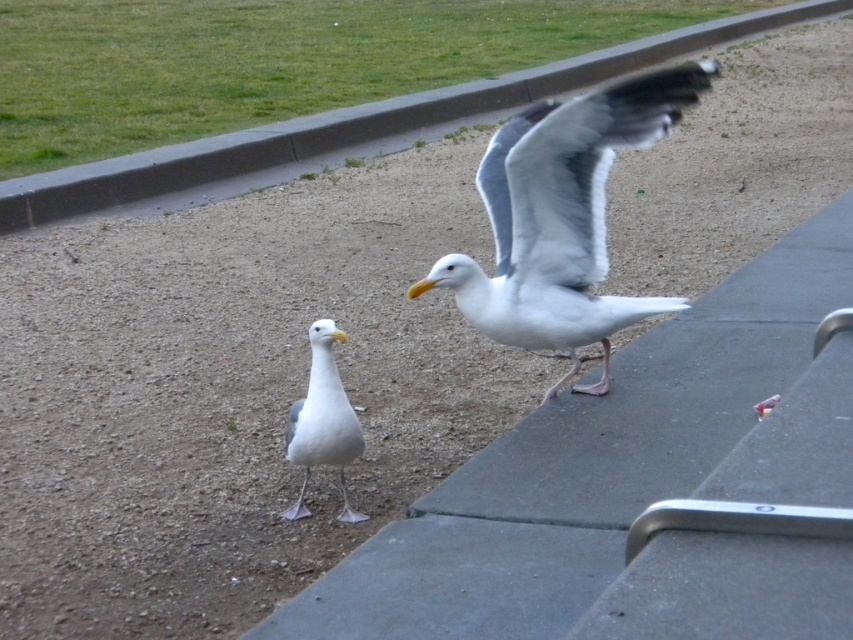
Does gray concrete curb at upper center have a larger size compared to white matte seagull at center?

Yes, gray concrete curb at upper center is bigger than white matte seagull at center.

What do you see at coordinates (347, 129) in the screenshot? I see `gray concrete curb at upper center` at bounding box center [347, 129].

Is point (764, 22) closer to camera compared to point (293, 435)?

No, it is behind (293, 435).

Where is `gray concrete curb at upper center`? This screenshot has height=640, width=853. gray concrete curb at upper center is located at coordinates (347, 129).

Is white feathered bird at center smaller than gray concrete curb at upper center?

Indeed, white feathered bird at center has a smaller size compared to gray concrete curb at upper center.

Between point (567, 204) and point (463, 92), which one is positioned in front?

Point (567, 204) is more forward.

Is point (643, 88) behind point (602, 77)?

No, (643, 88) is closer to viewer.

Find the location of a particular element. This screenshot has width=853, height=640. white feathered bird at center is located at coordinates (561, 218).

Which is above, white feathered bird at center or white matte seagull at center?

Positioned higher is white feathered bird at center.

Who is positioned more to the left, white feathered bird at center or white matte seagull at center?

From the viewer's perspective, white matte seagull at center appears more on the left side.

Is point (489, 202) more distant than point (293, 424)?

Yes.

You are a GUI agent. You are given a task and a screenshot of the screen. Output one action in this format:
    pyautogui.click(x=<x>, y=<y>)
    Task: Click on the white feathered bird at center
    
    Given the screenshot: What is the action you would take?
    click(x=561, y=218)